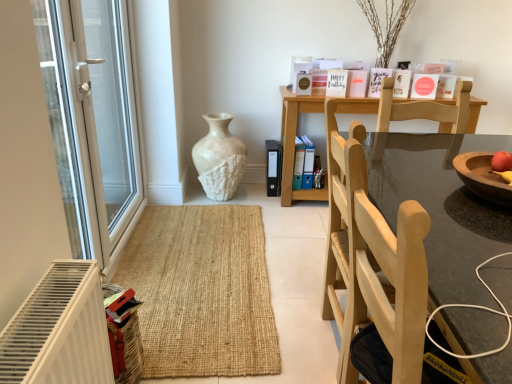
Question: Considering the relative positions of blue plastic file at center, the second book positioned from the front, and matte white card at upper center, the second book in the back-to-front sequence, in the image provided, is blue plastic file at center, the second book positioned from the front, in front of matte white card at upper center, the second book in the back-to-front sequence,?

Choices:
 (A) no
 (B) yes

Answer: (A)

Question: From the image's perspective, does blue plastic file at center, which ranks as the second book in top-to-bottom order, appear higher than matte white card at upper center, which ranks as the 1th book in front-to-back order?

Choices:
 (A) yes
 (B) no

Answer: (B)

Question: Is blue plastic file at center, the first book positioned from the back, aimed at matte white card at upper center, which ranks as the 1th book in front-to-back order?

Choices:
 (A) no
 (B) yes

Answer: (A)

Question: Can you see blue plastic file at center, the second book positioned from the front, touching matte white card at upper center, the second book in the back-to-front sequence?

Choices:
 (A) yes
 (B) no

Answer: (B)

Question: Does blue plastic file at center, the second book positioned from the front, lie behind matte white card at upper center, positioned as the 1th book in top-to-bottom order?

Choices:
 (A) yes
 (B) no

Answer: (A)

Question: Can you confirm if blue plastic file at center, the first book positioned from the back, is wider than matte white card at upper center, positioned as the 1th book in top-to-bottom order?

Choices:
 (A) yes
 (B) no

Answer: (A)

Question: Would you say transparent glass door at left is a long distance from matte white card at upper center, which ranks as the 1th book in front-to-back order?

Choices:
 (A) no
 (B) yes

Answer: (B)

Question: From a real-world perspective, is transparent glass door at left over matte white card at upper center, which is the 2th book in bottom-to-top order?

Choices:
 (A) yes
 (B) no

Answer: (B)

Question: From the image's perspective, is transparent glass door at left located beneath matte white card at upper center, the second book in the left-to-right sequence?

Choices:
 (A) no
 (B) yes

Answer: (B)

Question: Can you confirm if transparent glass door at left is bigger than matte white card at upper center, which is the 2th book in bottom-to-top order?

Choices:
 (A) no
 (B) yes

Answer: (B)

Question: Are transparent glass door at left and matte white card at upper center, positioned as the 1th book in top-to-bottom order, beside each other?

Choices:
 (A) no
 (B) yes

Answer: (A)

Question: Can you confirm if transparent glass door at left is shorter than matte white card at upper center, acting as the 1th book starting from the right?

Choices:
 (A) yes
 (B) no

Answer: (B)

Question: Does wooden round table at center have a lesser width compared to white textured vase at center?

Choices:
 (A) no
 (B) yes

Answer: (A)